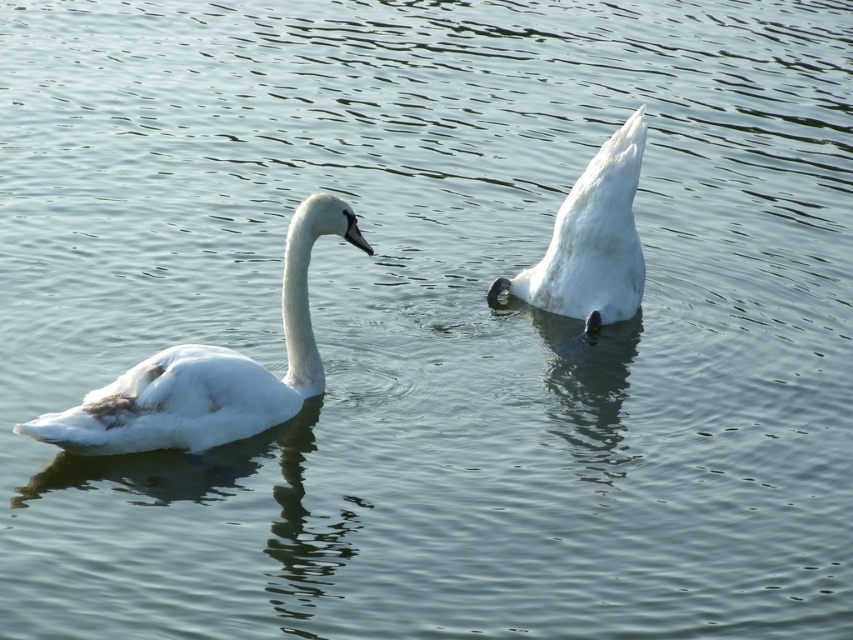
Question: Which point is farther from the camera taking this photo?

Choices:
 (A) (636, 284)
 (B) (193, 348)

Answer: (A)

Question: Can you confirm if white matte swan at left is positioned below white matte swan at center?

Choices:
 (A) no
 (B) yes

Answer: (B)

Question: Among these points, which one is farthest from the camera?

Choices:
 (A) (347, 216)
 (B) (585, 317)

Answer: (B)

Question: Is white matte swan at left positioned before white matte swan at center?

Choices:
 (A) yes
 (B) no

Answer: (A)

Question: Is white matte swan at left to the left of white matte swan at center from the viewer's perspective?

Choices:
 (A) yes
 (B) no

Answer: (A)